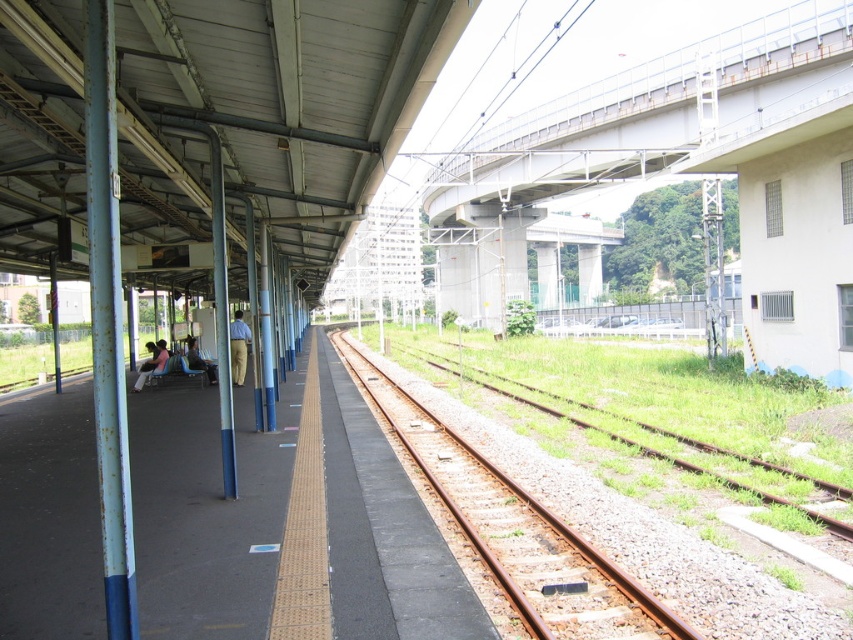
Between point (143, 369) and point (212, 378), which one is positioned in front?

Point (143, 369) is more forward.

Who is positioned more to the right, pink fabric chair at left or light brown fabric chair at left?

light brown fabric chair at left is more to the right.

Between point (152, 342) and point (213, 380), which one is positioned in front?

Point (213, 380) is in front.

The height and width of the screenshot is (640, 853). In order to click on pink fabric chair at left in this screenshot , I will do `click(151, 362)`.

Does brown metal train track at center have a lesser height compared to pink fabric chair at left?

Correct, brown metal train track at center is not as tall as pink fabric chair at left.

Does point (403, 413) come behind point (158, 340)?

No, (403, 413) is closer to viewer.

Identify the location of brown metal train track at center. The height and width of the screenshot is (640, 853). (517, 532).

From the picture: Is brown metal train track at center positioned in front of light brown fabric pants at center?

Yes, it is.

Is point (405, 397) in front of point (230, 333)?

That is False.

This screenshot has height=640, width=853. Identify the location of brown metal train track at center. (517, 532).